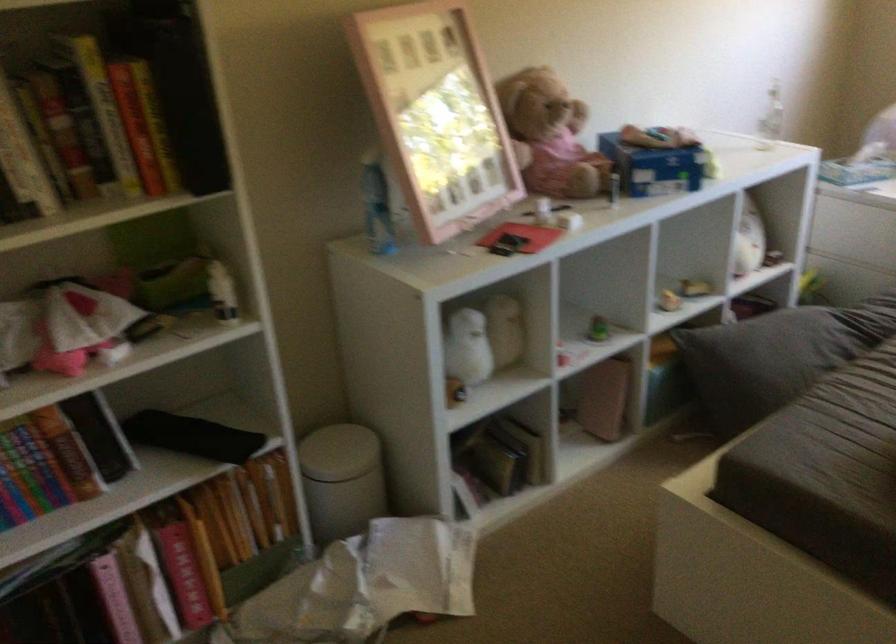
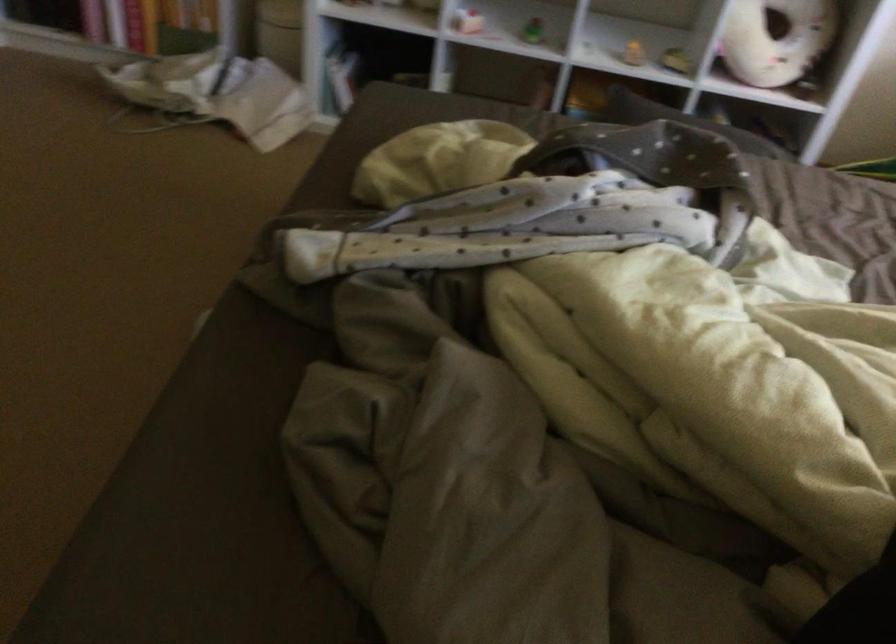
Locate, in the second image, the point that corresponds to point (253, 554) in the first image.

(177, 13)